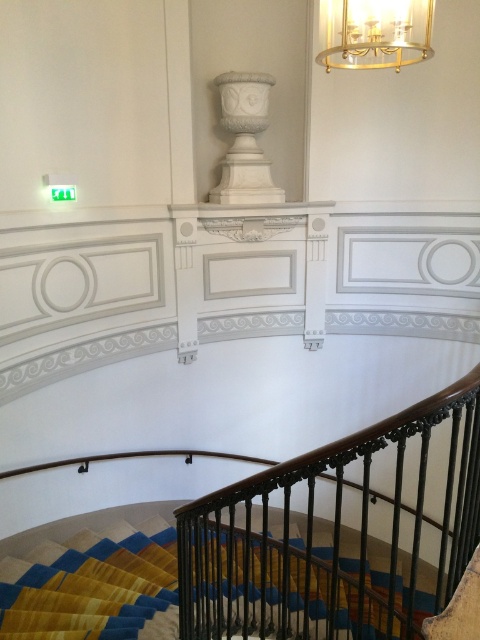
You are an interior designer planning to install a new 7.5 feet long decorative beam between the gold metallic chandelier at upper center and the white marble urn at upper center. Based on the current spacing, will the beam fit between them without overlapping either object?

The gold metallic chandelier at upper center is 8.01 feet away from the white marble urn at upper center. Since the beam is 7.5 feet long, it will fit between them with a small gap of 0.51 feet remaining.